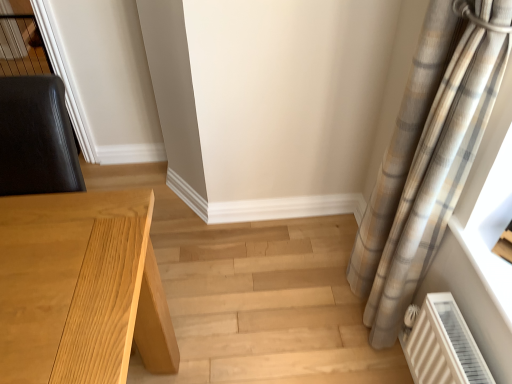
You are a GUI agent. You are given a task and a screenshot of the screen. Output one action in this format:
    pyautogui.click(x=<x>, y=<y>)
    Task: Click on the light wood table at left
    
    Given the screenshot: What is the action you would take?
    pyautogui.click(x=80, y=289)

Image resolution: width=512 pixels, height=384 pixels. Describe the element at coordinates (80, 289) in the screenshot. I see `light wood table at left` at that location.

In order to face light wood table at left, should I rotate leftwards or rightwards?

Turn left by 29.167 degrees to look at light wood table at left.

Measure the distance between point (411, 176) and camera.

The depth of point (411, 176) is 1.12 meters.

The height and width of the screenshot is (384, 512). What do you see at coordinates (429, 155) in the screenshot? I see `plaid fabric curtain at right` at bounding box center [429, 155].

Find the location of a particular element. The height and width of the screenshot is (384, 512). plaid fabric curtain at right is located at coordinates (429, 155).

What are the coordinates of `light wood table at left` in the screenshot? It's located at (80, 289).

Does plaid fabric curtain at right appear on the right side of light wood table at left?

Yes.

Relative to light wood table at left, is plaid fabric curtain at right in front or behind?

plaid fabric curtain at right is positioned farther from the viewer than light wood table at left.

Which is closer to the camera, (402, 289) or (123, 229)?

Point (402, 289) is farther from the camera than point (123, 229).

From the image's perspective, is plaid fabric curtain at right located above light wood table at left?

Yes, from the image's perspective, plaid fabric curtain at right is on top of light wood table at left.

From a real-world perspective, which object stands above the other?

In real-world perspective, plaid fabric curtain at right is above.

Can you confirm if plaid fabric curtain at right is thinner than light wood table at left?

Correct, the width of plaid fabric curtain at right is less than that of light wood table at left.

Does plaid fabric curtain at right have a lesser height compared to light wood table at left?

No.

Between plaid fabric curtain at right and light wood table at left, which one has larger size?

With larger size is light wood table at left.

Is plaid fabric curtain at right not within light wood table at left?

plaid fabric curtain at right lies outside light wood table at left's area.

Would you say plaid fabric curtain at right is a long distance from light wood table at left?

plaid fabric curtain at right is near light wood table at left, not far away.

Is plaid fabric curtain at right oriented away from light wood table at left?

No, plaid fabric curtain at right is not facing the opposite direction of light wood table at left.

Measure the distance between plaid fabric curtain at right and light wood table at left.

A distance of 77.80 centimeters exists between plaid fabric curtain at right and light wood table at left.

I want to click on table that appears below the plaid fabric curtain at right (from a real-world perspective), so [80, 289].

Considering the positions of objects light wood table at left and plaid fabric curtain at right in the image provided, who is more to the left, light wood table at left or plaid fabric curtain at right?

light wood table at left.

Which object is further away from the camera taking this photo, light wood table at left or plaid fabric curtain at right?

plaid fabric curtain at right is more distant.

Between point (91, 258) and point (408, 234), which one is positioned behind?

The point (408, 234) is behind.

From the image's perspective, which one is positioned lower, light wood table at left or plaid fabric curtain at right?

light wood table at left.

From a real-world perspective, is light wood table at left under plaid fabric curtain at right?

Correct, in the physical world, light wood table at left is lower than plaid fabric curtain at right.

Can you confirm if light wood table at left is wider than plaid fabric curtain at right?

Correct, the width of light wood table at left exceeds that of plaid fabric curtain at right.

Between light wood table at left and plaid fabric curtain at right, which one has less height?

Standing shorter between the two is light wood table at left.

Considering the relative sizes of light wood table at left and plaid fabric curtain at right in the image provided, is light wood table at left smaller than plaid fabric curtain at right?

No, light wood table at left is not smaller than plaid fabric curtain at right.

Would you say plaid fabric curtain at right is part of light wood table at left's contents?

No, plaid fabric curtain at right is located outside of light wood table at left.

Is light wood table at left far from plaid fabric curtain at right?

No, light wood table at left is in close proximity to plaid fabric curtain at right.

Is light wood table at left turned away from plaid fabric curtain at right?

No, light wood table at left's orientation is not away from plaid fabric curtain at right.

This screenshot has height=384, width=512. I want to click on table on the left of plaid fabric curtain at right, so click(80, 289).

Identify the location of curtain to the right of light wood table at left. (429, 155).

The image size is (512, 384). What are the coordinates of `curtain that appears behind the light wood table at left` in the screenshot? It's located at (429, 155).